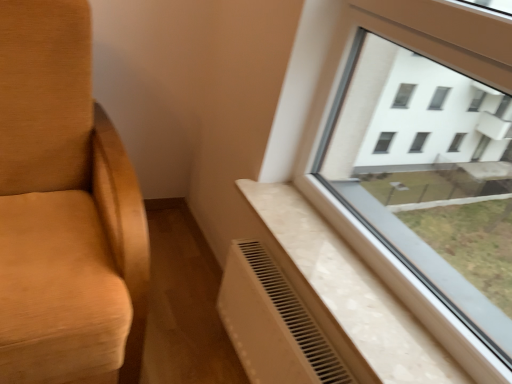
The width and height of the screenshot is (512, 384). Find the location of `white textured radiator at lower right`. white textured radiator at lower right is located at coordinates (371, 292).

What do you see at coordinates (371, 292) in the screenshot?
I see `white textured radiator at lower right` at bounding box center [371, 292].

This screenshot has height=384, width=512. Describe the element at coordinates (273, 323) in the screenshot. I see `white plastic radiator at lower center` at that location.

Locate an element on the screen. This screenshot has width=512, height=384. white plastic radiator at lower center is located at coordinates (273, 323).

The image size is (512, 384). In order to click on white textured radiator at lower right in this screenshot , I will do `click(371, 292)`.

Visually, is white plastic radiator at lower center positioned to the left or to the right of white textured radiator at lower right?

Clearly, white plastic radiator at lower center is on the left of white textured radiator at lower right in the image.

Based on the photo, considering the positions of objects white plastic radiator at lower center and white textured radiator at lower right in the image provided, who is in front, white plastic radiator at lower center or white textured radiator at lower right?

white textured radiator at lower right.

Which is in front, point (259, 341) or point (381, 348)?

The point (381, 348) is in front.

From the image's perspective, between white plastic radiator at lower center and white textured radiator at lower right, which one is located above?

From the image's view, white textured radiator at lower right is above.

From a real-world perspective, between white plastic radiator at lower center and white textured radiator at lower right, who is vertically higher?

From a 3D spatial view, white textured radiator at lower right is above.

Consider the image. Considering the sizes of white plastic radiator at lower center and white textured radiator at lower right in the image, is white plastic radiator at lower center wider or thinner than white textured radiator at lower right?

Clearly, white plastic radiator at lower center has less width compared to white textured radiator at lower right.

In the scene shown: Can you confirm if white plastic radiator at lower center is shorter than white textured radiator at lower right?

Incorrect, the height of white plastic radiator at lower center does not fall short of that of white textured radiator at lower right.

Between white plastic radiator at lower center and white textured radiator at lower right, which one has larger size?

white plastic radiator at lower center.

Is white plastic radiator at lower center situated inside white textured radiator at lower right or outside?

white plastic radiator at lower center is not inside white textured radiator at lower right, it's outside.

Is white plastic radiator at lower center directly adjacent to white textured radiator at lower right?

No, white plastic radiator at lower center is not next to white textured radiator at lower right.

Does white plastic radiator at lower center turn towards white textured radiator at lower right?

No, white plastic radiator at lower center is not turned towards white textured radiator at lower right.

Consider the image. How many degrees apart are the facing directions of white plastic radiator at lower center and white textured radiator at lower right?

0.459 degrees.

Identify the location of air conditioning below the white textured radiator at lower right (from the image's perspective). (273, 323).

In the scene shown: Considering the relative positions of white textured radiator at lower right and white plastic radiator at lower center in the image provided, is white textured radiator at lower right to the left of white plastic radiator at lower center from the viewer's perspective?

No.

In the image, is white textured radiator at lower right positioned in front of or behind white plastic radiator at lower center?

white textured radiator at lower right is in front of white plastic radiator at lower center.

Does point (337, 224) lie in front of point (267, 366)?

No, (337, 224) is further to viewer.

From the image's perspective, which object appears higher, white textured radiator at lower right or white plastic radiator at lower center?

From the image's view, white textured radiator at lower right is above.

From a real-world perspective, which object rests below the other?

From a 3D spatial view, white plastic radiator at lower center is below.

Does white textured radiator at lower right have a lesser width compared to white plastic radiator at lower center?

No, white textured radiator at lower right is not thinner than white plastic radiator at lower center.

Looking at this image, considering the relative sizes of white textured radiator at lower right and white plastic radiator at lower center in the image provided, is white textured radiator at lower right shorter than white plastic radiator at lower center?

Indeed, white textured radiator at lower right has a lesser height compared to white plastic radiator at lower center.

Considering the sizes of objects white textured radiator at lower right and white plastic radiator at lower center in the image provided, who is smaller, white textured radiator at lower right or white plastic radiator at lower center?

white textured radiator at lower right is smaller.

Which is correct: white textured radiator at lower right is inside white plastic radiator at lower center, or outside of it?

white textured radiator at lower right is located beyond the bounds of white plastic radiator at lower center.

Is white textured radiator at lower right far from white plastic radiator at lower center?

That's not correct — white textured radiator at lower right is a little close to white plastic radiator at lower center.

Is white textured radiator at lower right turned away from white plastic radiator at lower center?

white textured radiator at lower right does not have its back to white plastic radiator at lower center.

Locate an element on the screen. window sill that appears above the white plastic radiator at lower center (from the image's perspective) is located at coordinates [x=371, y=292].

This screenshot has width=512, height=384. Find the location of `air conditioning that appears below the white textured radiator at lower right (from the image's perspective)`. air conditioning that appears below the white textured radiator at lower right (from the image's perspective) is located at coordinates (273, 323).

Where is `air conditioning behind the white textured radiator at lower right`? Image resolution: width=512 pixels, height=384 pixels. air conditioning behind the white textured radiator at lower right is located at coordinates (273, 323).